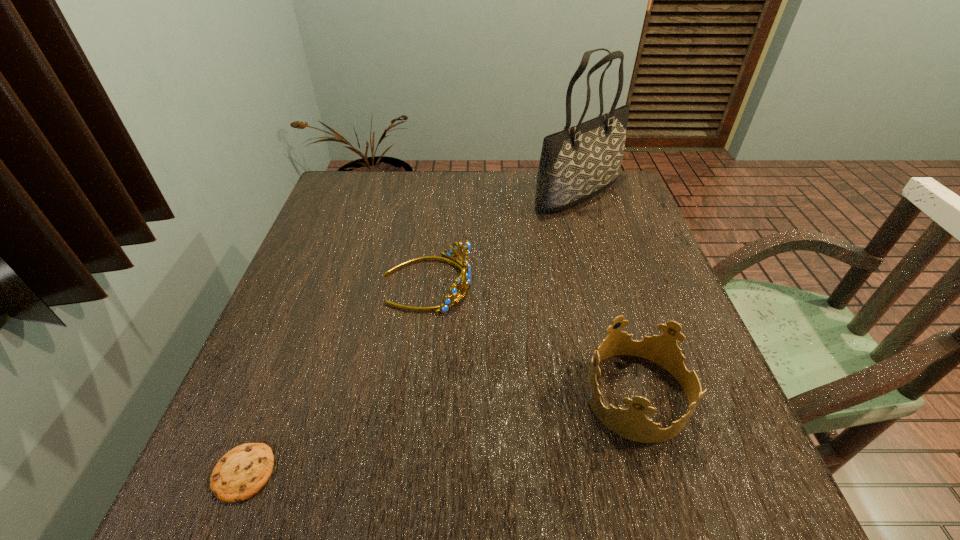
What are the coordinates of `vacant space located on the front-facing side of the third farthest object` in the screenshot? It's located at click(484, 395).

Locate an element on the screen. The height and width of the screenshot is (540, 960). vacant space located on the front-facing side of the third farthest object is located at coordinates (554, 395).

I want to click on free spot located 0.160m on the front-facing side of the third farthest object, so tap(500, 395).

At what (x,y) coordinates should I click in order to perform the action: click on vacant area situated on the back of the cookie. Please return your answer as a coordinate pair (x, y). Looking at the image, I should click on tap(309, 305).

This screenshot has width=960, height=540. In order to click on object at the far edge in this screenshot , I will do `click(577, 163)`.

Locate an element on the screen. The image size is (960, 540). object that is at the near edge is located at coordinates (242, 472).

At what (x,y) coordinates should I click in order to perform the action: click on object that is at the left edge. Please return your answer as a coordinate pair (x, y). This screenshot has width=960, height=540. Looking at the image, I should click on (242, 472).

At what (x,y) coordinates should I click in order to perform the action: click on tote bag present at the right edge. Please return your answer as a coordinate pair (x, y). This screenshot has height=540, width=960. Looking at the image, I should click on (577, 163).

At what (x,y) coordinates should I click in order to perform the action: click on tiara at the right edge. Please return your answer as a coordinate pair (x, y). Looking at the image, I should click on (631, 423).

This screenshot has width=960, height=540. What are the coordinates of `object that is at the near left corner` in the screenshot? It's located at (242, 472).